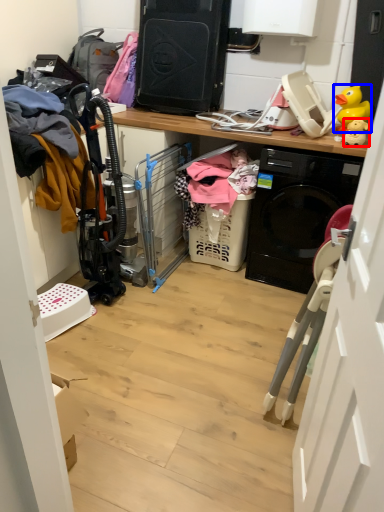
Question: Which of the following is the farthest to the observer, toy (highlighted by a red box) or toy (highlighted by a blue box)?

Choices:
 (A) toy
 (B) toy

Answer: (B)